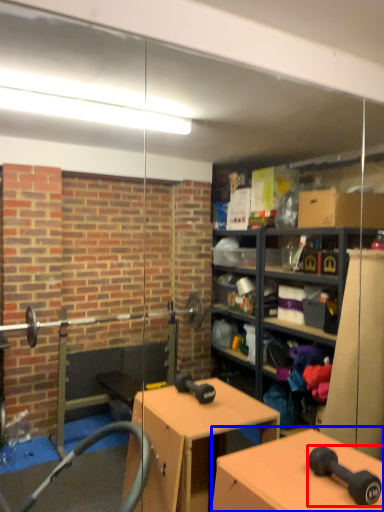
Question: Which object is further to the camera taking this photo, dumbbell (highlighted by a red box) or table (highlighted by a blue box)?

Choices:
 (A) dumbbell
 (B) table

Answer: (A)